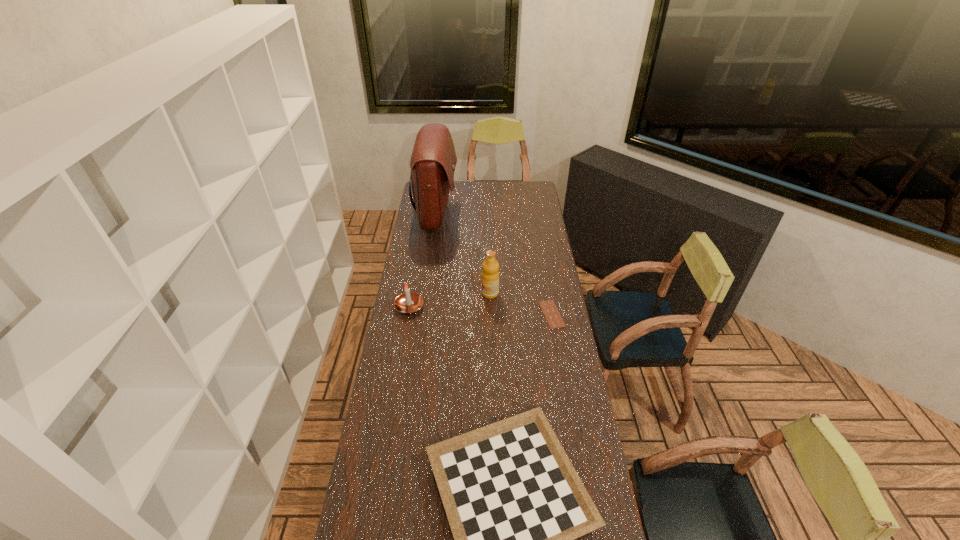
Where is `vacant space located on the left of the shortest object`? The width and height of the screenshot is (960, 540). vacant space located on the left of the shortest object is located at coordinates (474, 314).

Where is `object that is at the far edge`? object that is at the far edge is located at coordinates (433, 160).

Locate an element on the screen. satchel that is at the left edge is located at coordinates (433, 160).

Where is `candle that is at the left edge`? candle that is at the left edge is located at coordinates (408, 302).

The width and height of the screenshot is (960, 540). I want to click on object present at the right edge, so click(x=554, y=320).

Locate an element on the screen. This screenshot has width=960, height=540. object positioned at the far left corner is located at coordinates (433, 160).

In the image, there is a desktop. Identify the location of vacant space at the left edge. The width and height of the screenshot is (960, 540). (403, 415).

Where is `free space at the right edge of the desktop`? Image resolution: width=960 pixels, height=540 pixels. free space at the right edge of the desktop is located at coordinates (561, 357).

You are a GUI agent. You are given a task and a screenshot of the screen. Output one action in this format:
    pyautogui.click(x=<x>, y=<y>)
    Task: Click on the blank region between the satchel and the second tallest object
    This screenshot has height=540, width=960.
    Given the screenshot: What is the action you would take?
    pyautogui.click(x=464, y=254)

This screenshot has height=540, width=960. What are the coordinates of `vacant area that lies between the candle and the fruit juice` in the screenshot? It's located at (449, 300).